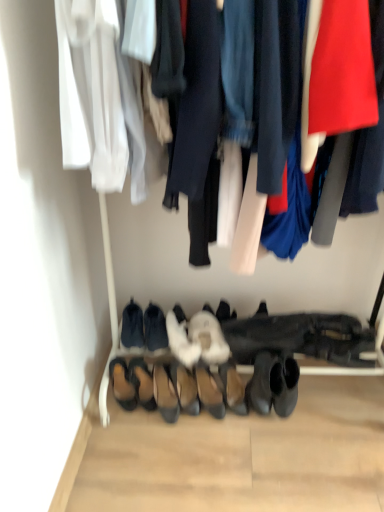
Image resolution: width=384 pixels, height=512 pixels. Describe the element at coordinates (209, 392) in the screenshot. I see `leather shoes at center, positioned as the 3th footwear in right-to-left order` at that location.

In order to face leather shoes at center, the eighth footwear viewed from the left, should I rotate leftwards or rightwards?

Rotate right and turn 2.381 degrees.

Where is `white fluffy slipper at center, which appears as the 2th footwear when viewed from the right`? This screenshot has height=512, width=384. white fluffy slipper at center, which appears as the 2th footwear when viewed from the right is located at coordinates (208, 338).

Image resolution: width=384 pixels, height=512 pixels. In order to click on black leather boot at lower center, which appears as the 10th footwear when viewed from the left in this screenshot , I will do tap(233, 388).

This screenshot has height=512, width=384. Describe the element at coordinates (165, 394) in the screenshot. I see `suede black heels at center, which is counted as the fifth footwear, starting from the left` at that location.

The height and width of the screenshot is (512, 384). I want to click on brown suede sandals at lower left, placed as the 1th footwear when sorted from left to right, so click(x=122, y=384).

Based on the photo, measure the distance between leather shoes at center, positioned as the 3th footwear in right-to-left order, and brown suede sandals at lower left, the 10th footwear when ordered from right to left.

10.76 inches.

Is leather shoes at center, the eighth footwear viewed from the left, to the right of brown suede sandals at lower left, placed as the 1th footwear when sorted from left to right, from the viewer's perspective?

Yes, leather shoes at center, the eighth footwear viewed from the left, is to the right of brown suede sandals at lower left, placed as the 1th footwear when sorted from left to right.

Can you confirm if leather shoes at center, positioned as the 3th footwear in right-to-left order, is shorter than brown suede sandals at lower left, placed as the 1th footwear when sorted from left to right?

In fact, leather shoes at center, positioned as the 3th footwear in right-to-left order, may be taller than brown suede sandals at lower left, placed as the 1th footwear when sorted from left to right.

From a real-world perspective, is black suede shoes at lower center, the 2th footwear when ordered from left to right, over brown suede shoes at center, which is the third footwear in left-to-right order?

Yes, from a real-world perspective, black suede shoes at lower center, the 2th footwear when ordered from left to right, is over brown suede shoes at center, which is the third footwear in left-to-right order

Which is correct: black suede shoes at lower center, the 2th footwear when ordered from left to right, is inside brown suede shoes at center, which is the third footwear in left-to-right order, or outside of it?

black suede shoes at lower center, the 2th footwear when ordered from left to right, lies outside brown suede shoes at center, which is the third footwear in left-to-right order.

Which is behind, black suede shoes at lower center, the 2th footwear when ordered from left to right, or brown suede shoes at center, which ranks as the eighth footwear in right-to-left order?

Positioned behind is black suede shoes at lower center, the 2th footwear when ordered from left to right.

Looking at this image, considering the positions of objects black suede shoes at lower center, which appears as the 9th footwear when viewed from the right, and brown suede shoes at center, which ranks as the eighth footwear in right-to-left order, in the image provided, who is more to the left, black suede shoes at lower center, which appears as the 9th footwear when viewed from the right, or brown suede shoes at center, which ranks as the eighth footwear in right-to-left order,?

From the viewer's perspective, black suede shoes at lower center, which appears as the 9th footwear when viewed from the right, appears more on the left side.

Would you say black suede booties at center, marked as the fourth footwear in a left-to-right arrangement, is inside or outside suede black heels at center, which is counted as the fifth footwear, starting from the left?

black suede booties at center, marked as the fourth footwear in a left-to-right arrangement, lies outside suede black heels at center, which is counted as the fifth footwear, starting from the left.

Is black suede booties at center, the seventh footwear in the right-to-left sequence, positioned with its back to suede black heels at center, arranged as the sixth footwear when viewed from the right?

No, suede black heels at center, arranged as the sixth footwear when viewed from the right, is not at the back of black suede booties at center, the seventh footwear in the right-to-left sequence.

Starting from the suede black heels at center, arranged as the sixth footwear when viewed from the right, which footwear is the 7th one behind? Please provide its 2D coordinates.

[(155, 328)]

Visually, is black suede booties at center, the seventh footwear in the right-to-left sequence, positioned to the left or to the right of suede black heels at center, arranged as the sixth footwear when viewed from the right?

Based on their positions, black suede booties at center, the seventh footwear in the right-to-left sequence, is located to the left of suede black heels at center, arranged as the sixth footwear when viewed from the right.

From a real-world perspective, which object stands above the other?

white fuzzy slippers at center, which ranks as the fourth footwear in right-to-left order, from a real-world perspective.

From the image's perspective, is leather shoes at center, positioned as the 3th footwear in right-to-left order, below white fuzzy slippers at center, which ranks as the fourth footwear in right-to-left order?

Yes, from the image's perspective, leather shoes at center, positioned as the 3th footwear in right-to-left order, is below white fuzzy slippers at center, which ranks as the fourth footwear in right-to-left order.

Is leather shoes at center, the eighth footwear viewed from the left, inside the boundaries of white fuzzy slippers at center, which ranks as the fourth footwear in right-to-left order, or outside?

leather shoes at center, the eighth footwear viewed from the left, is outside white fuzzy slippers at center, which ranks as the fourth footwear in right-to-left order.

In terms of width, does leather shoes at center, positioned as the 3th footwear in right-to-left order, look wider or thinner when compared to white fuzzy slippers at center, which ranks as the fourth footwear in right-to-left order?

leather shoes at center, positioned as the 3th footwear in right-to-left order, is thinner than white fuzzy slippers at center, which ranks as the fourth footwear in right-to-left order.

Based on the photo, is the depth of white fluffy slippers at center, the fifth footwear from the right, less than that of black suede booties at center, the seventh footwear in the right-to-left sequence?

Yes, white fluffy slippers at center, the fifth footwear from the right, is in front of black suede booties at center, the seventh footwear in the right-to-left sequence.

From a real-world perspective, who is located higher, white fluffy slippers at center, the fifth footwear from the right, or black suede booties at center, marked as the fourth footwear in a left-to-right arrangement?

black suede booties at center, marked as the fourth footwear in a left-to-right arrangement, is physically above.

Could you measure the distance between white fluffy slippers at center, which is the 6th footwear from left to right, and black suede booties at center, the seventh footwear in the right-to-left sequence?

white fluffy slippers at center, which is the 6th footwear from left to right, and black suede booties at center, the seventh footwear in the right-to-left sequence, are 2.46 inches apart.

Is white fluffy slippers at center, which is the 6th footwear from left to right, inside or outside of black suede booties at center, the seventh footwear in the right-to-left sequence?

white fluffy slippers at center, which is the 6th footwear from left to right, cannot be found inside black suede booties at center, the seventh footwear in the right-to-left sequence.

Is white fluffy slipper at center, which appears as the 2th footwear when viewed from the right, next to suede black heels at center, arranged as the sixth footwear when viewed from the right?

No, white fluffy slipper at center, which appears as the 2th footwear when viewed from the right, is not touching suede black heels at center, arranged as the sixth footwear when viewed from the right.

From a real-world perspective, is white fluffy slipper at center, which appears as the 2th footwear when viewed from the right, physically located above or below suede black heels at center, which is counted as the fifth footwear, starting from the left?

From a real-world perspective, white fluffy slipper at center, which appears as the 2th footwear when viewed from the right, is physically above suede black heels at center, which is counted as the fifth footwear, starting from the left.

Is white fluffy slipper at center, placed as the ninth footwear when sorted from left to right, facing away from suede black heels at center, which is counted as the fifth footwear, starting from the left?

No, suede black heels at center, which is counted as the fifth footwear, starting from the left, is not at the back of white fluffy slipper at center, placed as the ninth footwear when sorted from left to right.

Is black suede shoes at lower center, which appears as the 9th footwear when viewed from the right, bigger or smaller than black leather boot at lower center, which appears as the 10th footwear when viewed from the left?

black suede shoes at lower center, which appears as the 9th footwear when viewed from the right, is bigger than black leather boot at lower center, which appears as the 10th footwear when viewed from the left.

Choose the correct answer: Is black suede shoes at lower center, the 2th footwear when ordered from left to right, inside black leather boot at lower center, which appears as the 10th footwear when viewed from the left, or outside it?

black suede shoes at lower center, the 2th footwear when ordered from left to right, exists outside the volume of black leather boot at lower center, which appears as the 10th footwear when viewed from the left.

Image resolution: width=384 pixels, height=512 pixels. I want to click on the 7th footwear positioned above the black leather boot at lower center, the 1th footwear when ordered from right to left (from a real-world perspective), so click(132, 326).

Considering the relative positions of black suede shoes at lower center, the 2th footwear when ordered from left to right, and black leather boot at lower center, the 1th footwear when ordered from right to left, in the image provided, is black suede shoes at lower center, the 2th footwear when ordered from left to right, behind black leather boot at lower center, the 1th footwear when ordered from right to left,?

Yes, black suede shoes at lower center, the 2th footwear when ordered from left to right, is further from the viewer.

In order to click on the 3rd footwear in front of the brown suede sandals at lower left, the 10th footwear when ordered from right to left in this screenshot , I will do `click(209, 392)`.

From the image's perspective, which footwear is the 5th one above the brown suede shoes at center, which ranks as the eighth footwear in right-to-left order? Please provide its 2D coordinates.

[(132, 326)]

Estimate the real-world distances between objects in this image. Which object is further from white fuzzy slippers at center, which ranks as the fourth footwear in right-to-left order, leather shoes at center, the eighth footwear viewed from the left, or brown suede shoes at center, which ranks as the eighth footwear in right-to-left order?

Based on the image, brown suede shoes at center, which ranks as the eighth footwear in right-to-left order, appears to be further to white fuzzy slippers at center, which ranks as the fourth footwear in right-to-left order.

Looking at the image, which one is located further to suede black heels at center, which is counted as the fifth footwear, starting from the left, brown suede shoes at center, which is the third footwear in left-to-right order, or brown suede sandals at lower left, placed as the 1th footwear when sorted from left to right?

Among the two, brown suede sandals at lower left, placed as the 1th footwear when sorted from left to right, is located further to suede black heels at center, which is counted as the fifth footwear, starting from the left.

From the image, which object appears to be farther from leather shoes at center, positioned as the 3th footwear in right-to-left order, black suede booties at center, the seventh footwear in the right-to-left sequence, or black leather boot at lower center, the 1th footwear when ordered from right to left?

Based on the image, black suede booties at center, the seventh footwear in the right-to-left sequence, appears to be further to leather shoes at center, positioned as the 3th footwear in right-to-left order.

When comparing their distances from black suede shoes at lower center, the 2th footwear when ordered from left to right, does brown suede sandals at lower left, the 10th footwear when ordered from right to left, or brown suede shoes at center, which is the third footwear in left-to-right order, seem further?

Among the two, brown suede sandals at lower left, the 10th footwear when ordered from right to left, is located further to black suede shoes at lower center, the 2th footwear when ordered from left to right.

Considering their positions, is leather shoes at center, the eighth footwear viewed from the left, positioned closer to white fluffy slipper at center, which appears as the 2th footwear when viewed from the right, than black suede shoes at lower center, the 2th footwear when ordered from left to right?

leather shoes at center, the eighth footwear viewed from the left, lies closer to white fluffy slipper at center, which appears as the 2th footwear when viewed from the right, than the other object.

Which object lies further to the anchor point black suede booties at center, the seventh footwear in the right-to-left sequence, brown suede shoes at center, which is the third footwear in left-to-right order, or white fluffy slippers at center, which is the 6th footwear from left to right?

Among the two, brown suede shoes at center, which is the third footwear in left-to-right order, is located further to black suede booties at center, the seventh footwear in the right-to-left sequence.

Consider the image. From the image, which object appears to be nearer to brown suede sandals at lower left, placed as the 1th footwear when sorted from left to right, white fluffy slipper at center, placed as the ninth footwear when sorted from left to right, or brown suede shoes at center, which ranks as the eighth footwear in right-to-left order?

brown suede shoes at center, which ranks as the eighth footwear in right-to-left order.

Looking at the image, which one is located closer to white fluffy slipper at center, which appears as the 2th footwear when viewed from the right, black suede shoes at lower center, the 2th footwear when ordered from left to right, or white fuzzy slippers at center, which is the seventh footwear in left-to-right order?

Among the two, white fuzzy slippers at center, which is the seventh footwear in left-to-right order, is located nearer to white fluffy slipper at center, which appears as the 2th footwear when viewed from the right.